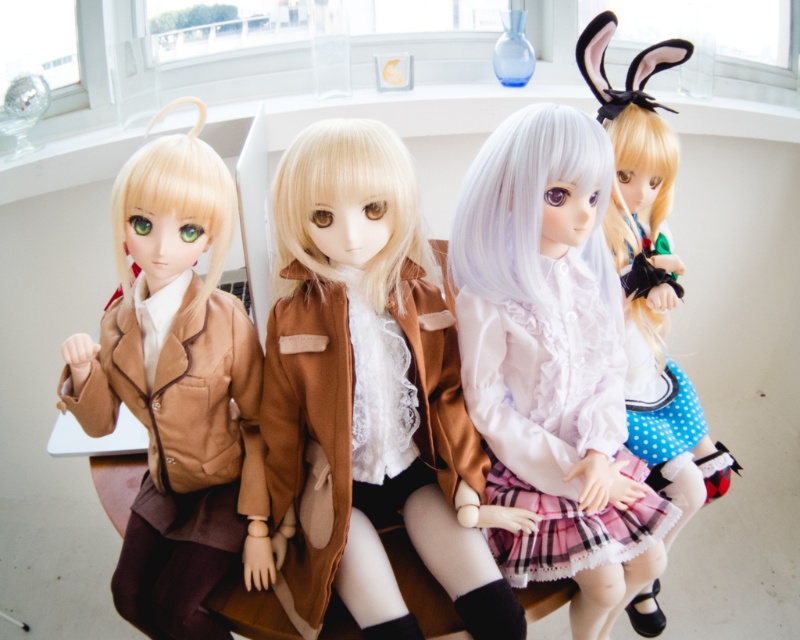
Question: Which of the following is the farthest from the observer?

Choices:
 (A) blue polka dot dress at right
 (B) white matte wig at upper right
 (C) satin brown coat at center

Answer: (A)

Question: Can you confirm if matte brown jacket at left is smaller than blue polka dot dress at right?

Choices:
 (A) no
 (B) yes

Answer: (A)

Question: Is satin brown coat at center to the left of matte white wig at center from the viewer's perspective?

Choices:
 (A) no
 (B) yes

Answer: (B)

Question: Which object appears closest to the camera in this image?

Choices:
 (A) white matte wig at upper right
 (B) matte brown jacket at left
 (C) satin brown coat at center
 (D) matte white wig at center

Answer: (C)

Question: Which object appears closest to the camera in this image?

Choices:
 (A) matte brown jacket at left
 (B) satin brown coat at center

Answer: (B)

Question: Is the position of satin brown coat at center less distant than that of matte brown jacket at left?

Choices:
 (A) no
 (B) yes

Answer: (B)